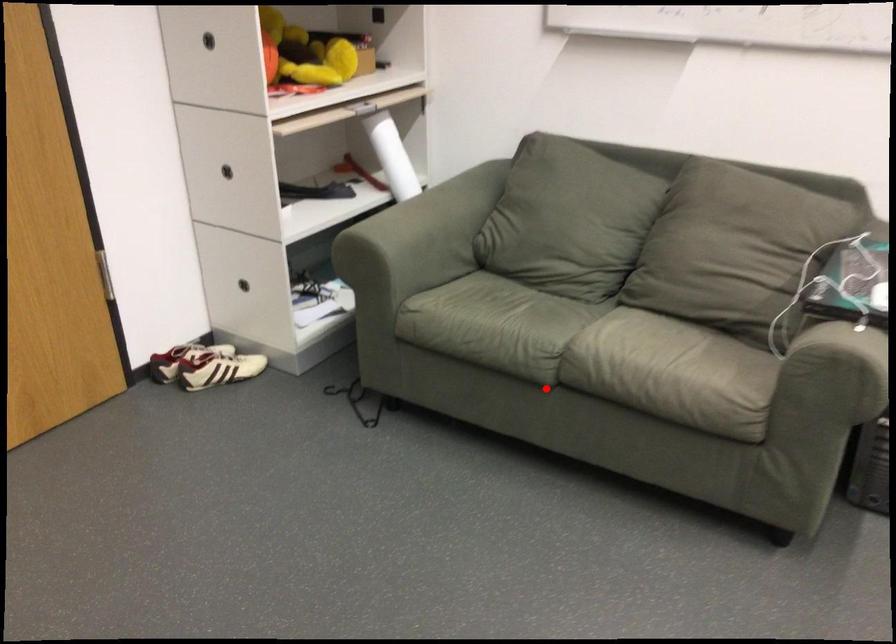
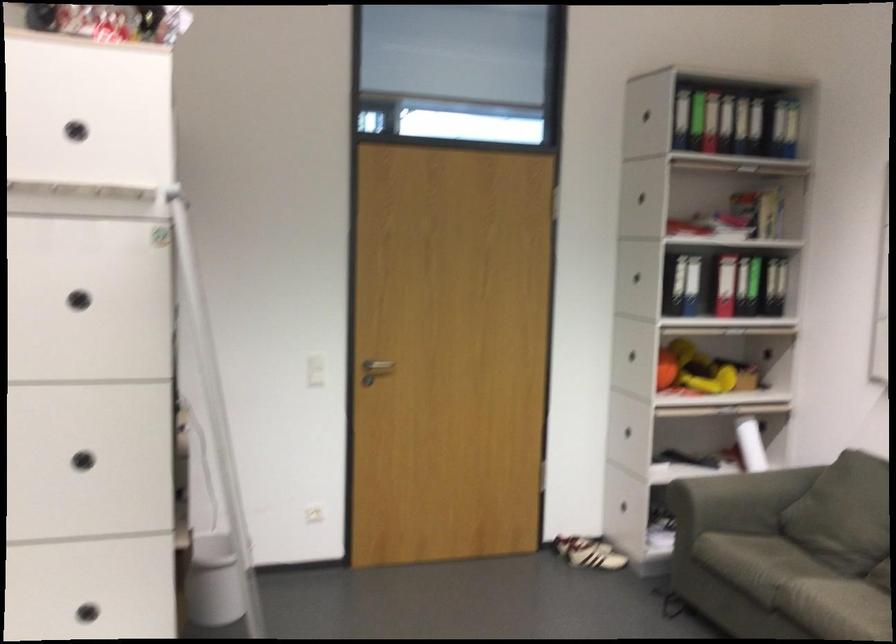
Where in the second image is the point corresponding to the highlighted location from the first image?

(771, 623)